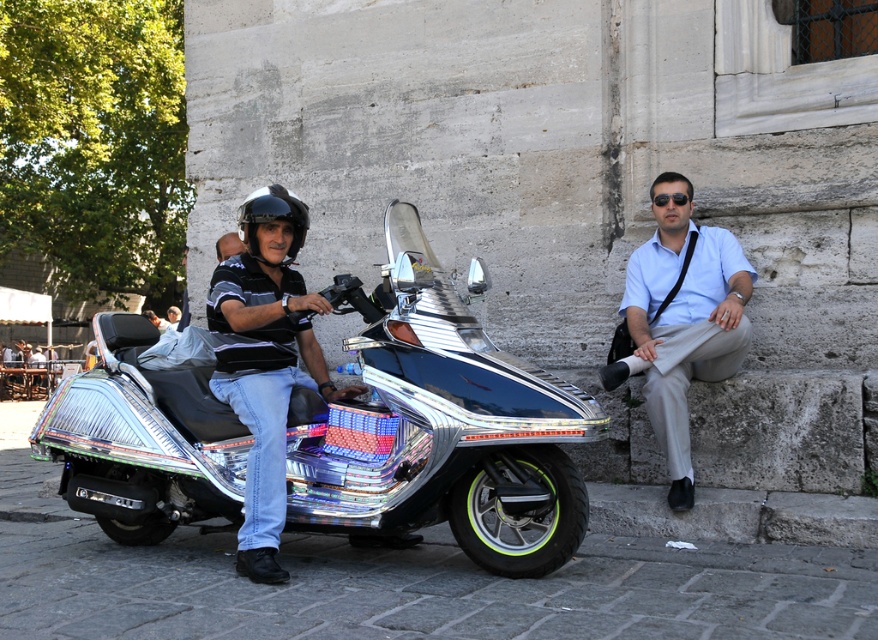
Which is in front, point (625, 320) or point (23, 344)?

Point (625, 320) is more forward.

Is light blue shirt at right to the right of brushed metal water at bottle left from the viewer's perspective?

Indeed, light blue shirt at right is positioned on the right side of brushed metal water at bottle left.

Which is behind, point (721, 362) or point (11, 376)?

Positioned behind is point (11, 376).

I want to click on light blue shirt at right, so click(682, 317).

Does point (284, 259) come in front of point (51, 349)?

That is True.

Does point (255, 195) come farther from viewer compared to point (19, 388)?

No.

Image resolution: width=878 pixels, height=640 pixels. I want to click on black matte helmet at center, so click(272, 220).

From the picture: Does shiny chrome scooter at center lie behind shiny metallic helmet at upper left?

No, shiny chrome scooter at center is closer to the viewer.

Can you confirm if shiny chrome scooter at center is positioned below shiny metallic helmet at upper left?

Yes, shiny chrome scooter at center is below shiny metallic helmet at upper left.

Where is `shiny chrome scooter at center`? The height and width of the screenshot is (640, 878). shiny chrome scooter at center is located at coordinates (439, 433).